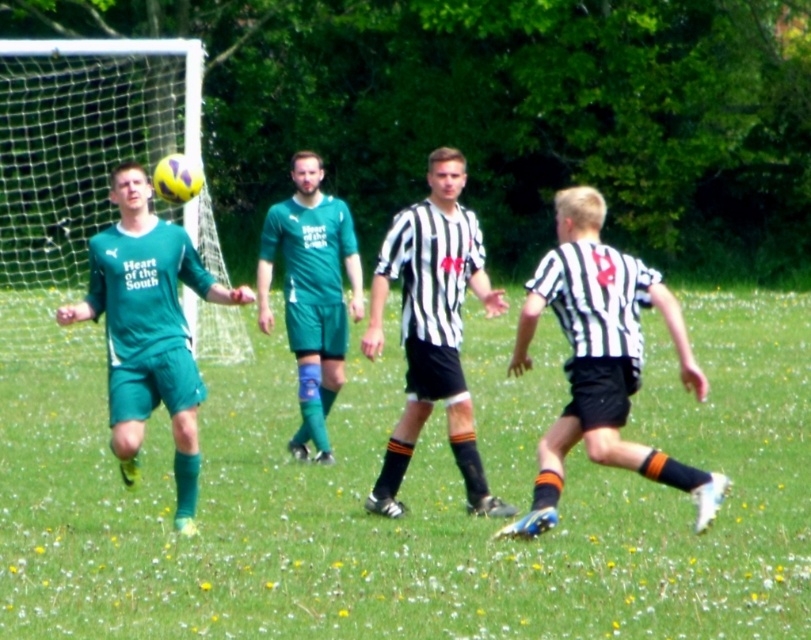
Question: Which is farther from the green grass at center?

Choices:
 (A) green matte soccer jersey at left
 (B) green matte uniform at center

Answer: (A)

Question: Can you confirm if green matte soccer jersey at left is positioned to the right of green matte uniform at center?

Choices:
 (A) yes
 (B) no

Answer: (B)

Question: Can you confirm if black and white striped shirt at center is positioned below green matte uniform at center?

Choices:
 (A) yes
 (B) no

Answer: (A)

Question: Does black and white striped shirt at right come in front of green matte soccer jersey at left?

Choices:
 (A) yes
 (B) no

Answer: (A)

Question: Which object is closer to the camera taking this photo?

Choices:
 (A) black and white striped shirt at center
 (B) black and white striped shirt at right
 (C) green matte soccer jersey at left
 (D) green grass at center

Answer: (D)

Question: Estimate the real-world distances between objects in this image. Which object is closer to the green matte uniform at center?

Choices:
 (A) green matte soccer jersey at left
 (B) black and white striped shirt at center
 (C) green grass at center

Answer: (B)